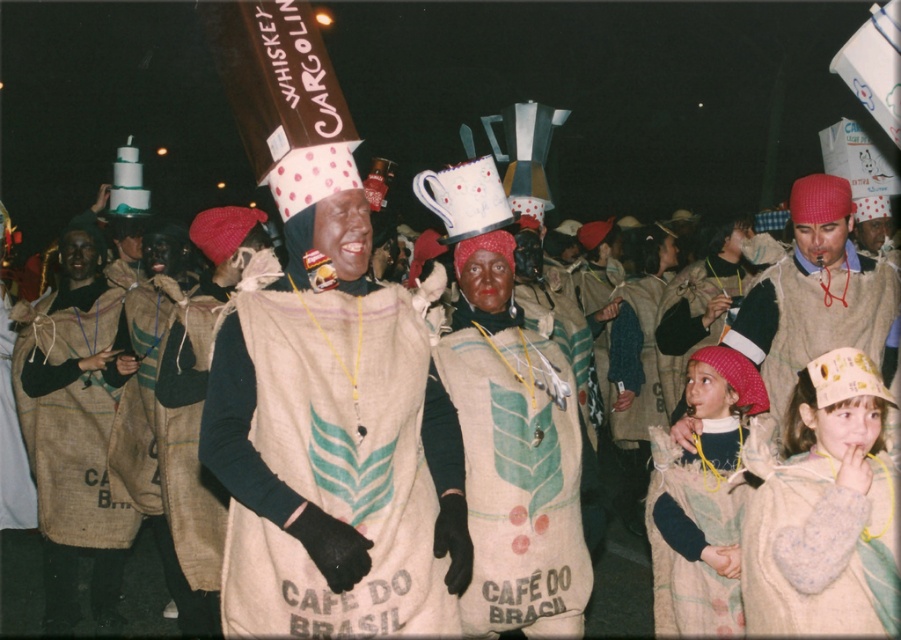
Question: In this image, where is fuzzy beige sweater at lower right located relative to fluffy beige sack at lower right?

Choices:
 (A) below
 (B) above

Answer: (B)

Question: Is matte burlap sack at center below fuzzy beige sweater at lower right?

Choices:
 (A) yes
 (B) no

Answer: (B)

Question: Which object is farther from the camera taking this photo?

Choices:
 (A) matte burlap sack at center
 (B) matte brown vest at center

Answer: (B)

Question: Which point is closer to the camera taking this photo?

Choices:
 (A) (544, 403)
 (B) (654, 436)
 (C) (405, 566)
 (D) (824, 301)

Answer: (C)

Question: Among these points, which one is farthest from the camera?

Choices:
 (A) 885,355
 (B) 497,433

Answer: (A)

Question: Does matte burlap sack at center appear on the right side of burlap sack at center?

Choices:
 (A) no
 (B) yes

Answer: (A)